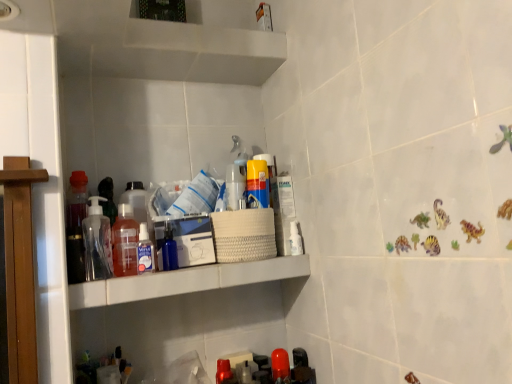
The image size is (512, 384). What are the coordinates of `free space between white plastic bottle at upper right, the first toiletry when ordered from back to front, and transparent plastic spray bottle at upper center, the 1th toiletry positioned from the front` in the screenshot? It's located at (218, 265).